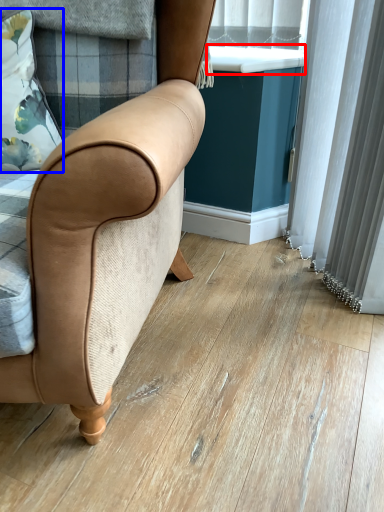
Question: Among these objects, which one is nearest to the camera, window sill (highlighted by a red box) or pillow (highlighted by a blue box)?

Choices:
 (A) window sill
 (B) pillow

Answer: (B)